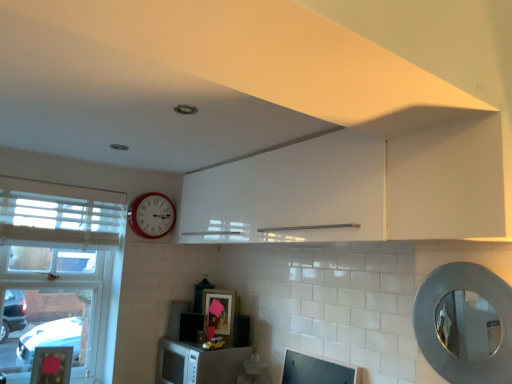
I want to click on satin black microwave at lower center, which appears as the first appliance when viewed from the back, so click(x=177, y=316).

This screenshot has height=384, width=512. Describe the element at coordinates (198, 363) in the screenshot. I see `white matte microwave at lower center` at that location.

What do you see at coordinates (221, 311) in the screenshot? This screenshot has width=512, height=384. I see `matte black picture frame at center` at bounding box center [221, 311].

Describe the element at coordinates (241, 331) in the screenshot. I see `black matte microwave at center, acting as the first appliance starting from the right` at that location.

You are a GUI agent. You are given a task and a screenshot of the screen. Output one action in this format:
    pyautogui.click(x=<x>, y=<y>)
    Task: Click on the satin black microwave at lower center, which is counted as the second appliance, starting from the front
    This screenshot has width=512, height=384.
    Given the screenshot: What is the action you would take?
    pyautogui.click(x=177, y=316)

Which is in front, point (137, 218) or point (298, 149)?

The point (298, 149) is more forward.

At what (x,y) coordinates should I click in order to perform the action: click on clock on the left of white glossy cabinet at upper center. Please return your answer as a coordinate pair (x, y). The width and height of the screenshot is (512, 384). Looking at the image, I should click on (151, 215).

Between red glossy clock at upper left and white glossy cabinet at upper center, which one has more height?

white glossy cabinet at upper center.

From the picture: Is red glossy clock at upper left facing towards white glossy cabinet at upper center?

Yes, red glossy clock at upper left is oriented towards white glossy cabinet at upper center.

Find the location of a particular element. This screenshot has height=384, width=512. appliance that is the 1st one below the red glossy clock at upper left (from a real-world perspective) is located at coordinates (177, 316).

From a real-world perspective, who is located lower, red glossy clock at upper left or satin black microwave at lower center, which appears as the first appliance when viewed from the back?

satin black microwave at lower center, which appears as the first appliance when viewed from the back.

Measure the distance from red glossy clock at upper left to satin black microwave at lower center, which ranks as the 2th appliance in right-to-left order.

red glossy clock at upper left is 20.16 inches away from satin black microwave at lower center, which ranks as the 2th appliance in right-to-left order.

Is point (173, 210) farther from camera compared to point (174, 336)?

Yes, it is behind point (174, 336).

Considering their positions, is white matte microwave at lower center located in front of or behind red glossy clock at upper left?

Clearly, white matte microwave at lower center is in front of red glossy clock at upper left.

Where is `clock above the white matte microwave at lower center (from a real-world perspective)`? clock above the white matte microwave at lower center (from a real-world perspective) is located at coordinates (151, 215).

Looking at this image, from a real-world perspective, is white matte microwave at lower center physically below red glossy clock at upper left?

Yes.

Based on the photo, from the image's perspective, is white matte microwave at lower center located above or below red glossy clock at upper left?

white matte microwave at lower center is situated lower than red glossy clock at upper left in the image.

Find the location of a particular element. cabinetry lying on the left of black matte microwave at center, the 2th appliance when ordered from left to right is located at coordinates (198, 363).

From a real-world perspective, relative to white matte microwave at lower center, is black matte microwave at center, which ranks as the 1th appliance in front-to-back order, vertically above or below?

Clearly, from a real-world perspective, black matte microwave at center, which ranks as the 1th appliance in front-to-back order, is above white matte microwave at lower center.

In terms of size, does black matte microwave at center, acting as the 2th appliance starting from the back, appear bigger or smaller than white matte microwave at lower center?

In the image, black matte microwave at center, acting as the 2th appliance starting from the back, appears to be smaller than white matte microwave at lower center.

Based on the photo, which object is positioned more to the left, black matte microwave at center, which ranks as the 1th appliance in front-to-back order, or white matte microwave at lower center?

white matte microwave at lower center.

Which point is more distant from viewer, (34, 249) or (206, 231)?

The point (34, 249) is more distant.

Between white wooden window at left and white glossy cabinet at upper center, which one has more height?

white wooden window at left is taller.

Does white wooden window at left have a smaller size compared to white glossy cabinet at upper center?

No, white wooden window at left is not smaller than white glossy cabinet at upper center.

What are the coordinates of `dresser on the right of white wooden window at left` in the screenshot? It's located at (360, 189).

Is white matte microwave at lower center next to silver textured mirror at right and touching it?

There is a gap between white matte microwave at lower center and silver textured mirror at right.

Is white matte microwave at lower center positioned with its back to silver textured mirror at right?

white matte microwave at lower center is not turned away from silver textured mirror at right.

From a real-world perspective, who is located higher, white matte microwave at lower center or silver textured mirror at right?

silver textured mirror at right is physically above.

Is white matte microwave at lower center thinner than silver textured mirror at right?

No.

From the image's perspective, would you say black matte microwave at center, which ranks as the 1th appliance in front-to-back order, is positioned over satin black microwave at lower center, positioned as the 1th appliance in left-to-right order?

No.

Which of these two, black matte microwave at center, the 2th appliance when ordered from left to right, or satin black microwave at lower center, which is counted as the second appliance, starting from the front, is thinner?

black matte microwave at center, the 2th appliance when ordered from left to right, is thinner.

Is black matte microwave at center, which ranks as the 1th appliance in front-to-back order, in front of or behind satin black microwave at lower center, positioned as the 1th appliance in left-to-right order, in the image?

Clearly, black matte microwave at center, which ranks as the 1th appliance in front-to-back order, is in front of satin black microwave at lower center, positioned as the 1th appliance in left-to-right order.

Where is `clock located below the white glossy cabinet at upper center (from the image's perspective)`? This screenshot has width=512, height=384. clock located below the white glossy cabinet at upper center (from the image's perspective) is located at coordinates (151, 215).

I want to click on clock above the satin black microwave at lower center, which is counted as the second appliance, starting from the front (from a real-world perspective), so click(x=151, y=215).

Based on the photo, from the image, which object appears to be nearer to matte black monitor at lower center, red glossy clock at upper left or white glossy cabinet at upper center?

white glossy cabinet at upper center is positioned closer to the anchor matte black monitor at lower center.

When comparing their distances from red glossy clock at upper left, does black matte microwave at center, the 2th appliance when ordered from left to right, or white wooden window at left seem closer?

The object closer to red glossy clock at upper left is white wooden window at left.

When comparing their distances from black matte microwave at center, acting as the 2th appliance starting from the back, does white glossy cabinet at upper center or silver textured mirror at right seem further?

Among the two, silver textured mirror at right is located further to black matte microwave at center, acting as the 2th appliance starting from the back.

Consider the image. Which object lies nearer to the anchor point silver textured mirror at right, red glossy clock at upper left or white glossy cabinet at upper center?

white glossy cabinet at upper center lies closer to silver textured mirror at right than the other object.

Considering their positions, is white wooden window at left positioned further to white glossy cabinet at upper center than white matte microwave at lower center?

Based on the image, white wooden window at left appears to be further to white glossy cabinet at upper center.

Considering their positions, is matte black monitor at lower center positioned closer to matte black picture frame at center than white glossy cabinet at upper center?

The object closer to matte black picture frame at center is matte black monitor at lower center.

Which object lies further to the anchor point red glossy clock at upper left, satin black microwave at lower center, which is counted as the second appliance, starting from the front, or white glossy cabinet at upper center?

white glossy cabinet at upper center lies further to red glossy clock at upper left than the other object.

Looking at the image, which one is located closer to silver textured mirror at right, matte black monitor at lower center or white wooden window at left?

matte black monitor at lower center.

Identify the location of picture frame located between silver textured mirror at right and red glossy clock at upper left in the depth direction. This screenshot has width=512, height=384. (221, 311).

Locate an element on the screen. The width and height of the screenshot is (512, 384). computer monitor between white glossy cabinet at upper center and black matte microwave at center, the 2th appliance when ordered from left to right, in the front-back direction is located at coordinates (316, 370).

At what (x,y) coordinates should I click in order to perform the action: click on window between white glossy cabinet at upper center and satin black microwave at lower center, positioned as the 1th appliance in left-to-right order, in the front-back direction. Please return your answer as a coordinate pair (x, y). The width and height of the screenshot is (512, 384). Looking at the image, I should click on (57, 276).

This screenshot has height=384, width=512. What are the coordinates of `cabinetry between matte black monitor at lower center and black matte microwave at center, acting as the first appliance starting from the right, from front to back` in the screenshot? It's located at (198, 363).